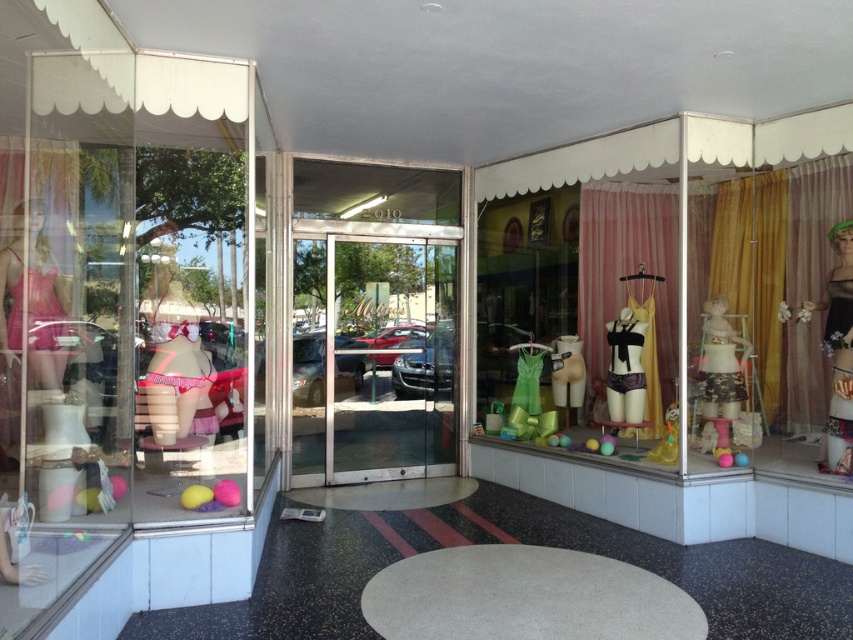
Does matte pink doll at center lie in front of purple satin lingerie at center?

Yes, matte pink doll at center is in front of purple satin lingerie at center.

Is point (728, 332) closer to viewer compared to point (619, 385)?

That is True.

Who is more forward, (717, 460) or (621, 308)?

Point (717, 460) is more forward.

Identify the location of matte pink doll at center. This screenshot has width=853, height=640. (722, 376).

Which is more to the left, shiny black dress at right or purple satin lingerie at center?

purple satin lingerie at center

Between point (833, 289) and point (627, 328), which one is positioned in front?

Positioned in front is point (833, 289).

Which is in front, point (822, 305) or point (607, 342)?

Point (822, 305)

Identify the location of shiny black dress at right. Image resolution: width=853 pixels, height=640 pixels. (838, 352).

From the picture: Is gold fabric curtain at right to the left of matte pink doll at center from the viewer's perspective?

In fact, gold fabric curtain at right is to the right of matte pink doll at center.

Who is higher up, gold fabric curtain at right or matte pink doll at center?

gold fabric curtain at right is above.

What are the coordinates of `gold fabric curtain at right` in the screenshot? It's located at (753, 268).